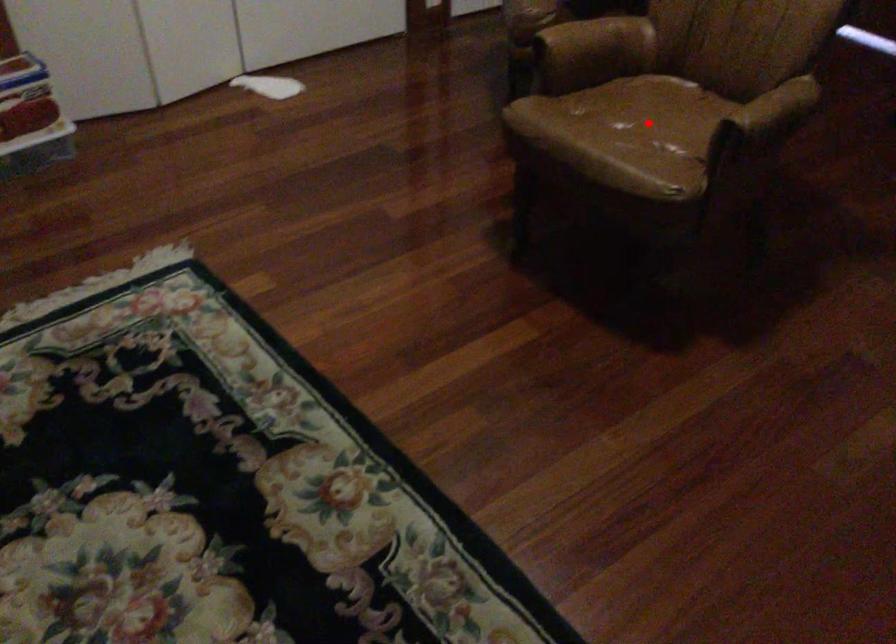
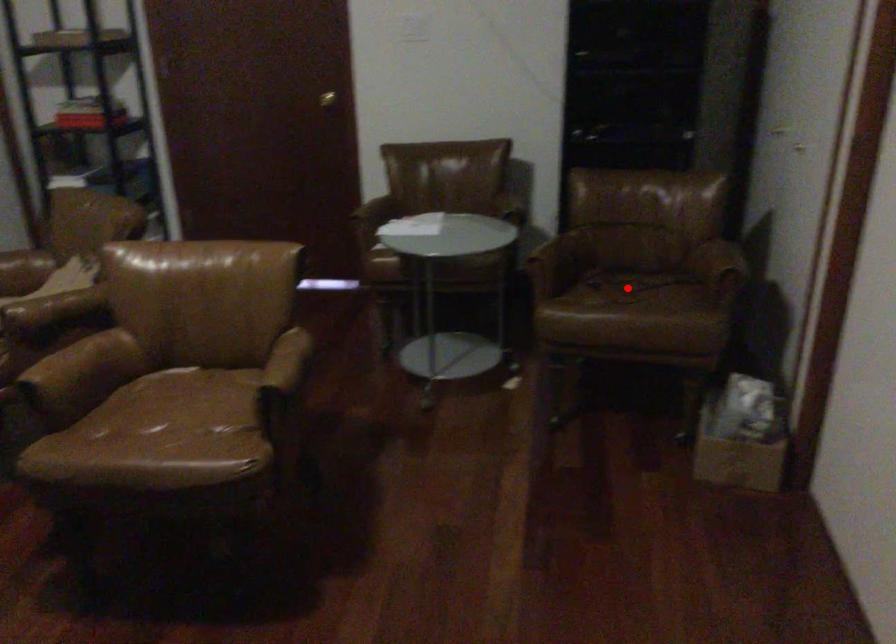
I am providing you with two images of the same scene from different viewpoints. A red point is marked on the first image and another point is marked on the second image. Is the marked point in image1 the same physical position as the marked point in image2?

No